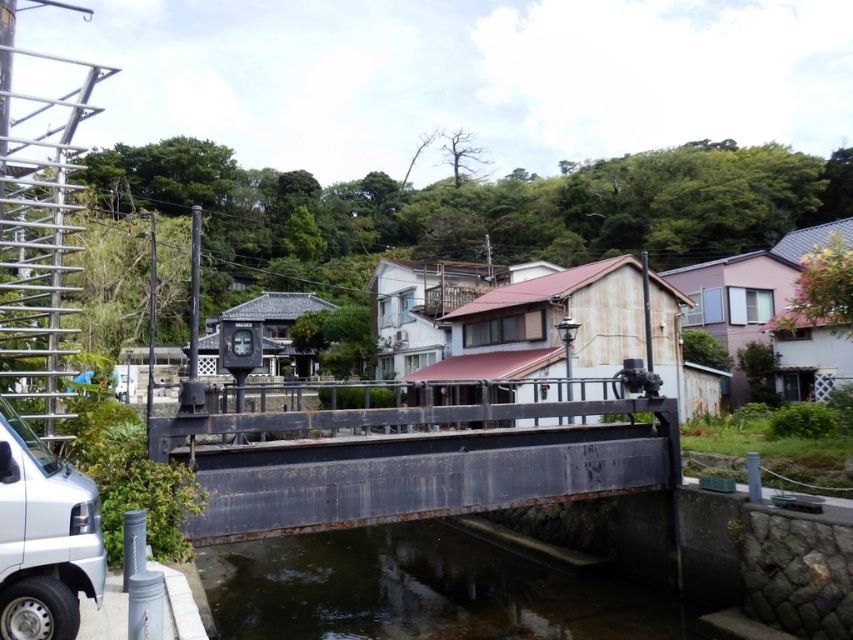
Looking at this image, can you confirm if clear water at bridge center is taller than silver metallic van at lower left?

Yes.

Between point (602, 604) and point (16, 632), which one is positioned behind?

The point (602, 604) is behind.

Locate an element on the screen. clear water at bridge center is located at coordinates (422, 589).

Does rusty metal bridge at center appear on the right side of silver metallic van at lower left?

Indeed, rusty metal bridge at center is positioned on the right side of silver metallic van at lower left.

In the scene shown: Does rusty metal bridge at center have a lesser width compared to silver metallic van at lower left?

No, rusty metal bridge at center is not thinner than silver metallic van at lower left.

Where is `rusty metal bridge at center`? This screenshot has height=640, width=853. rusty metal bridge at center is located at coordinates (412, 461).

Is rusty metal bridge at center further to camera compared to clear water at bridge center?

No.

Is rusty metal bridge at center below clear water at bridge center?

Actually, rusty metal bridge at center is above clear water at bridge center.

Where is `rusty metal bridge at center`? The width and height of the screenshot is (853, 640). rusty metal bridge at center is located at coordinates (412, 461).